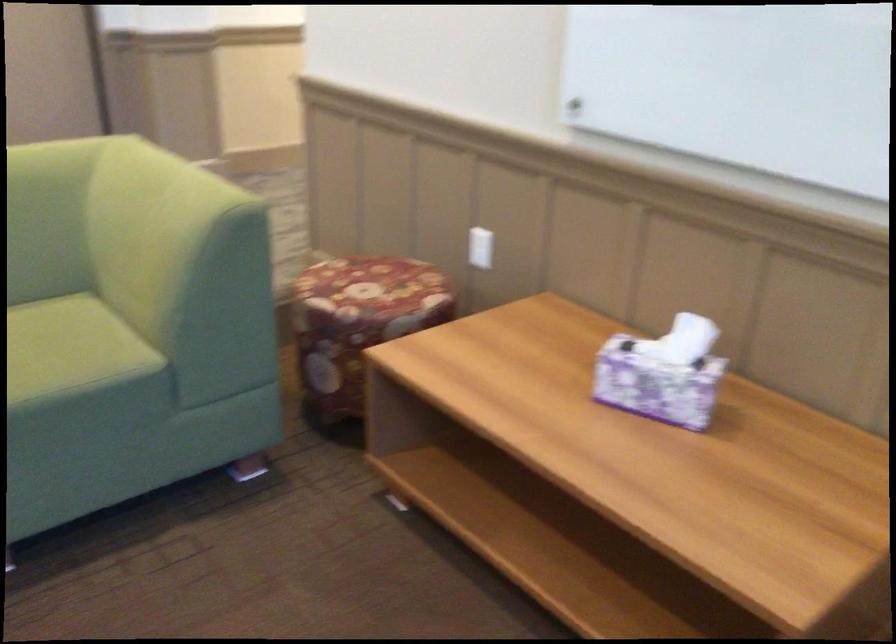
What are the coordinates of `green sofa sitting surface` in the screenshot? It's located at (46, 339).